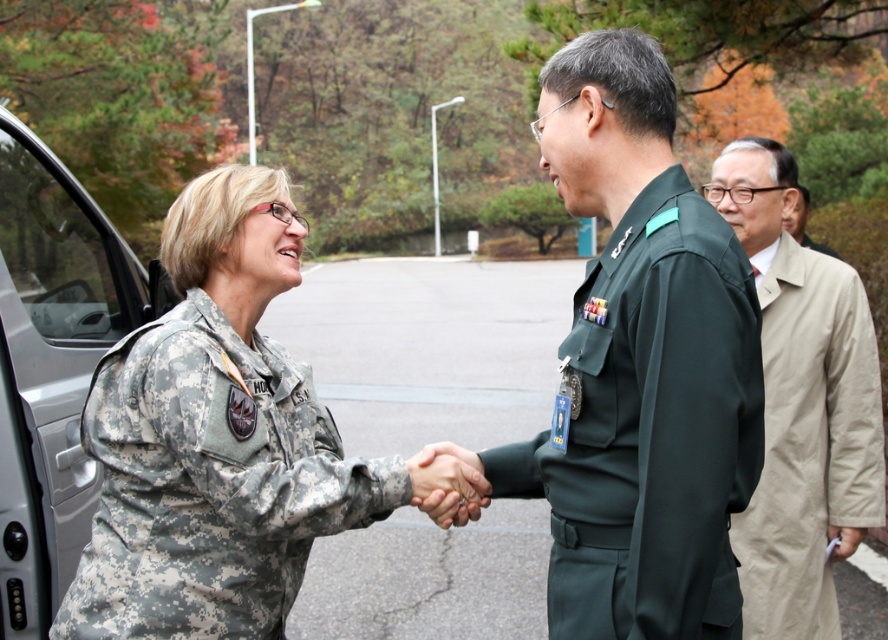
Question: Can you confirm if camouflage fabric uniform at center is wider than camouflage fabric hand at center?

Choices:
 (A) yes
 (B) no

Answer: (A)

Question: Considering the real-world distances, which object is closest to the camouflage fabric uniform at center?

Choices:
 (A) beige trench coat at right
 (B) camouflage fabric hand at center
 (C) green uniform at center
 (D) tan fabric coat at right

Answer: (B)

Question: Which point is farther from the camera taking this photo?

Choices:
 (A) (696, 396)
 (B) (421, 454)
 (C) (865, 442)

Answer: (C)

Question: Which of these objects is positioned farthest from the beige trench coat at right?

Choices:
 (A) tan fabric coat at right
 (B) camouflage fabric hand at center
 (C) camouflage fabric uniform at center
 (D) green uniform at center

Answer: (C)

Question: In this image, where is camouflage fabric uniform at center located relative to tan fabric coat at right?

Choices:
 (A) right
 (B) left

Answer: (B)

Question: Is camouflage fabric car at left positioned behind camouflage fabric hand at center?

Choices:
 (A) no
 (B) yes

Answer: (A)